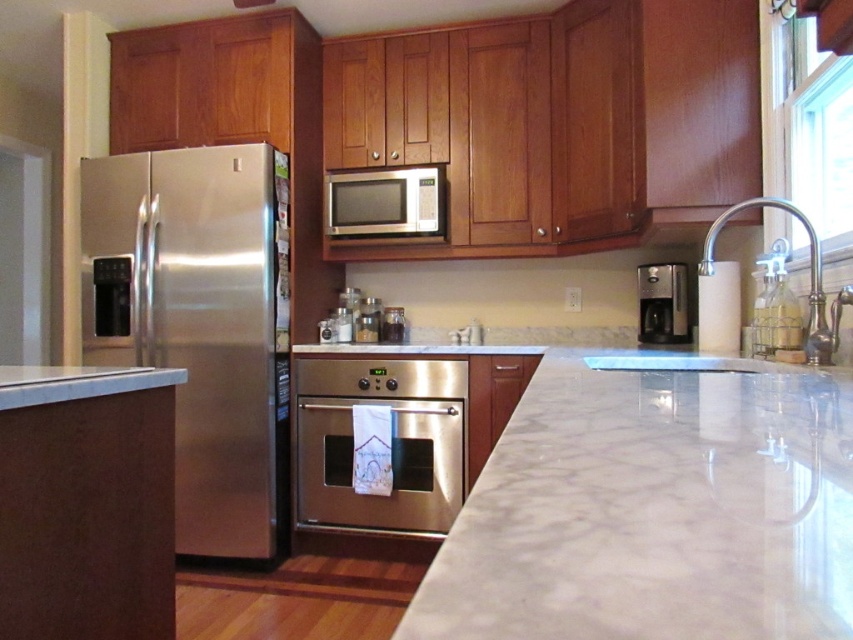
Consider the image. You are organizing a dinner party and need to fit a large cake into either the stainless steel refrigerator at left or the satin silver microwave at upper center. Which appliance should you choose based on their sizes?

The stainless steel refrigerator at left has a larger width than the satin silver microwave at upper center, so you should choose the stainless steel refrigerator at left to fit the large cake.

You are a kitchen designer planning to install a new spice rack between the satin silver microwave at upper center and the matte glass jar at center. The spice rack requires 24 inches of space. Based on the current setup, will there be enough space for the spice rack?

The distance between the satin silver microwave at upper center and the matte glass jar at center is 23.23 inches. Since the spice rack requires 24 inches, there is insufficient space for installation.